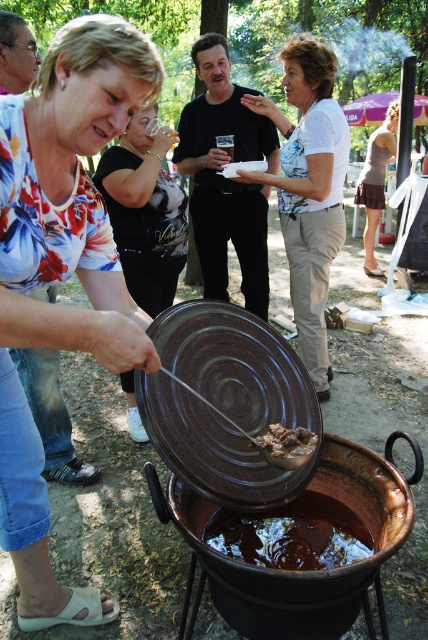
You are a guest at the picnic and you want to take a photo of the white floral blouse at center and the brown glossy liquid at center. Which one should you zoom in on to make sure both are in focus?

The white floral blouse at center is bigger than the brown glossy liquid at center, so you should zoom in on the white floral blouse at center to ensure both are in focus.

What object is located at the coordinates point [225,179] in the scene?

The point [225,179] corresponds to the black matte pot at center.